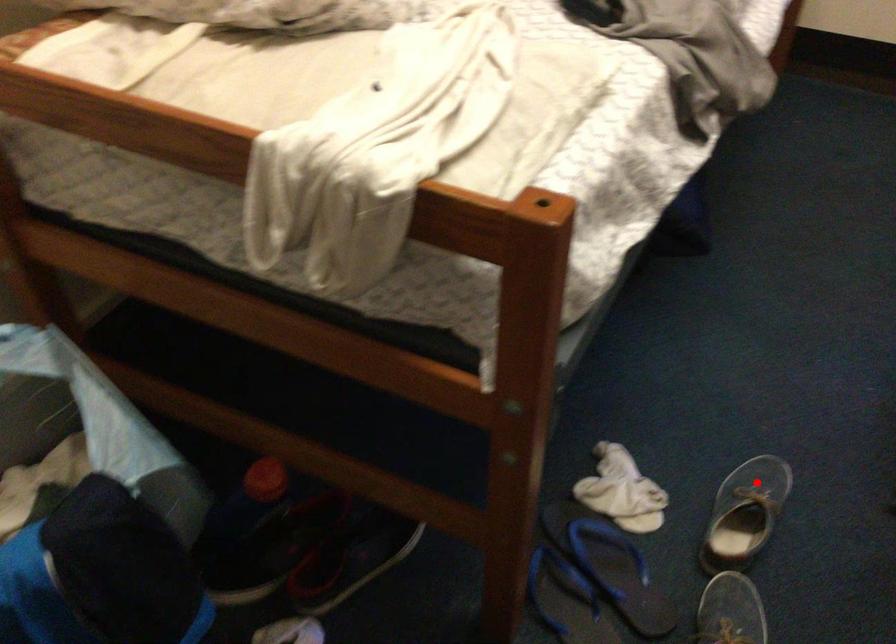
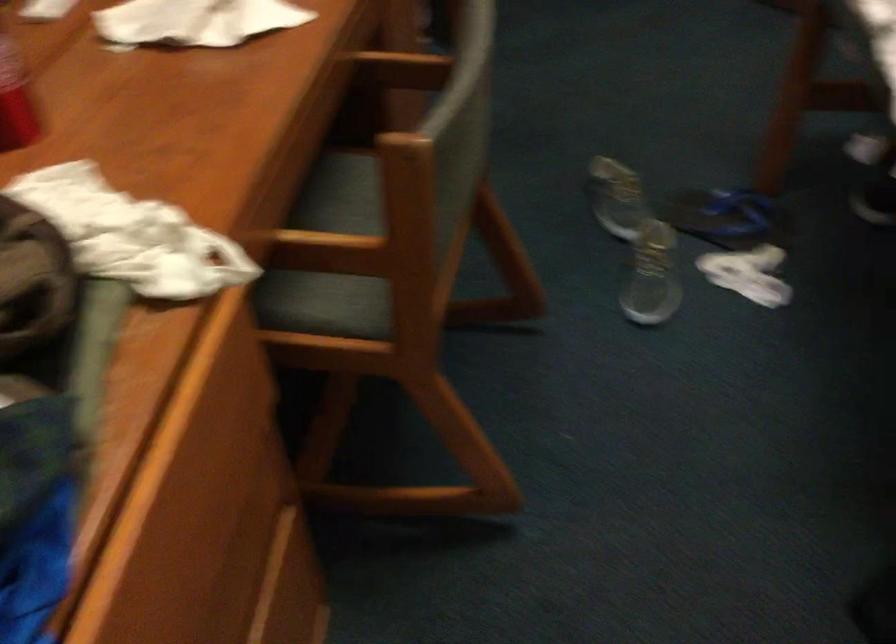
Locate, in the second image, the point that corresponds to the highlighted location in the first image.

(650, 287)